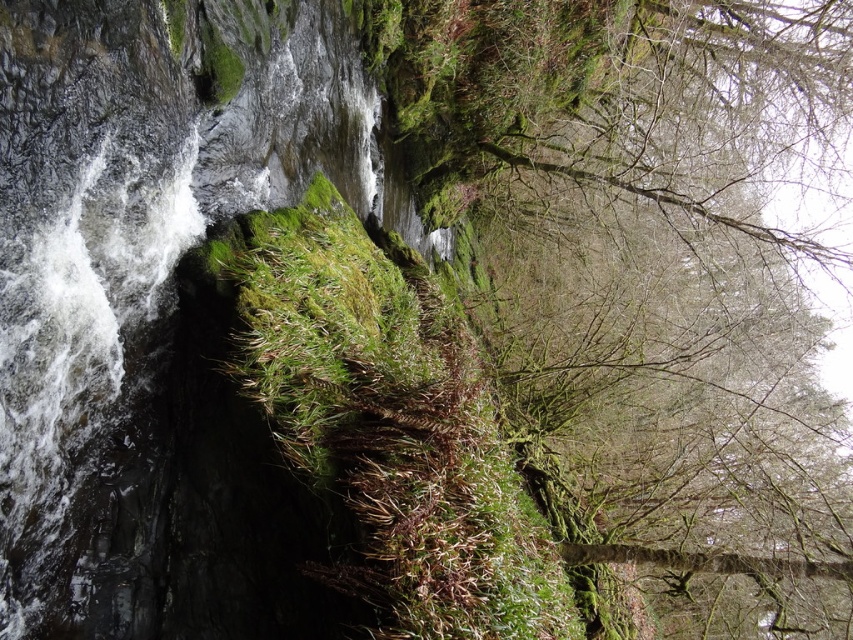
You are standing at the edge of the stream and want to cross to the other side. The clear water at left flows over the green mossy rock at center. Which object should you avoid stepping on to cross safely?

You should avoid stepping on the green mossy rock at center because the clear water at left is much taller than it, meaning the rock might be submerged or slippery under the flowing water.

You are standing at the base of the waterfall and want to walk towards the green mossy tree at upper center and the green mossy rock at center. Which object will you reach first?

You will reach the green mossy rock at center first because it is closer to you than the green mossy tree at upper center, which is further away.